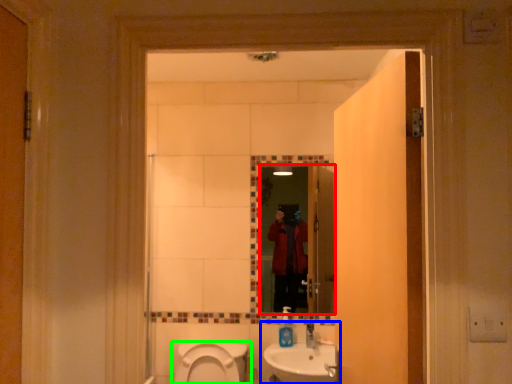
Question: Considering the real-world distances, which object is farthest from mirror (highlighted by a red box)? sink (highlighted by a blue box) or toilet (highlighted by a green box)?

Choices:
 (A) sink
 (B) toilet

Answer: (B)